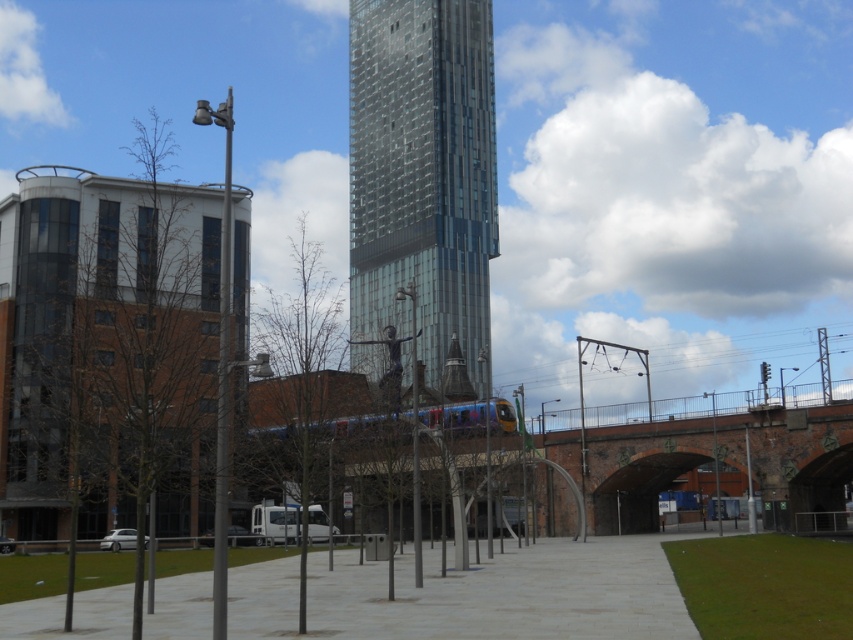
Who is positioned more to the right, glassy metallic skyscraper at center or brick archway at center?

Positioned to the right is brick archway at center.

Does glassy metallic skyscraper at center have a smaller size compared to brick archway at center?

Result: No.

I want to click on glassy metallic skyscraper at center, so click(x=422, y=172).